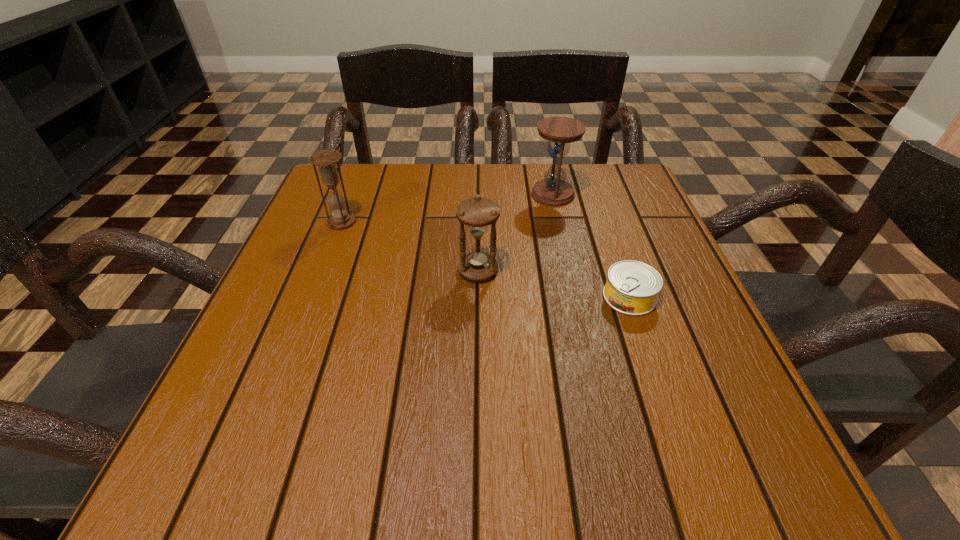
Choose which object is the second nearest neighbor to the can. Please provide its 2D coordinates. Your answer should be formatted as a tuple, i.e. [(x, y)], where the tuple contains the x and y coordinates of a point satisfying the conditions above.

[(553, 190)]

Identify which object is the third closest to the second object from left to right. Please provide its 2D coordinates. Your answer should be formatted as a tuple, i.e. [(x, y)], where the tuple contains the x and y coordinates of a point satisfying the conditions above.

[(326, 160)]

Locate which hourglass ranks second in proximity to the rightmost hourglass. Please provide its 2D coordinates. Your answer should be formatted as a tuple, i.e. [(x, y)], where the tuple contains the x and y coordinates of a point satisfying the conditions above.

[(326, 160)]

Point out which hourglass is positioned as the nearest to the leftmost hourglass. Please provide its 2D coordinates. Your answer should be formatted as a tuple, i.e. [(x, y)], where the tuple contains the x and y coordinates of a point satisfying the conditions above.

[(477, 265)]

Where is `blank space that satisfies the following two spatial constraints: 1. on the front side of the nearest hourglass; 2. on the left side of the shortest object`? The width and height of the screenshot is (960, 540). blank space that satisfies the following two spatial constraints: 1. on the front side of the nearest hourglass; 2. on the left side of the shortest object is located at coordinates (478, 297).

Locate an element on the screen. vacant position in the image that satisfies the following two spatial constraints: 1. on the front side of the shortest object; 2. on the left side of the leftmost hourglass is located at coordinates (312, 297).

Locate an element on the screen. free location that satisfies the following two spatial constraints: 1. on the back side of the farthest hourglass; 2. on the left side of the second farthest hourglass is located at coordinates (352, 194).

Where is `free location that satisfies the following two spatial constraints: 1. on the front side of the second farthest object; 2. on the right side of the second object from left to right`? This screenshot has width=960, height=540. free location that satisfies the following two spatial constraints: 1. on the front side of the second farthest object; 2. on the right side of the second object from left to right is located at coordinates (323, 271).

Find the location of a particular element. This screenshot has height=540, width=960. blank space that satisfies the following two spatial constraints: 1. on the front side of the rightmost hourglass; 2. on the right side of the shortest object is located at coordinates (576, 297).

In order to click on blank space that satisfies the following two spatial constraints: 1. on the front side of the rightmost hourglass; 2. on the right side of the can in this screenshot , I will do `click(576, 297)`.